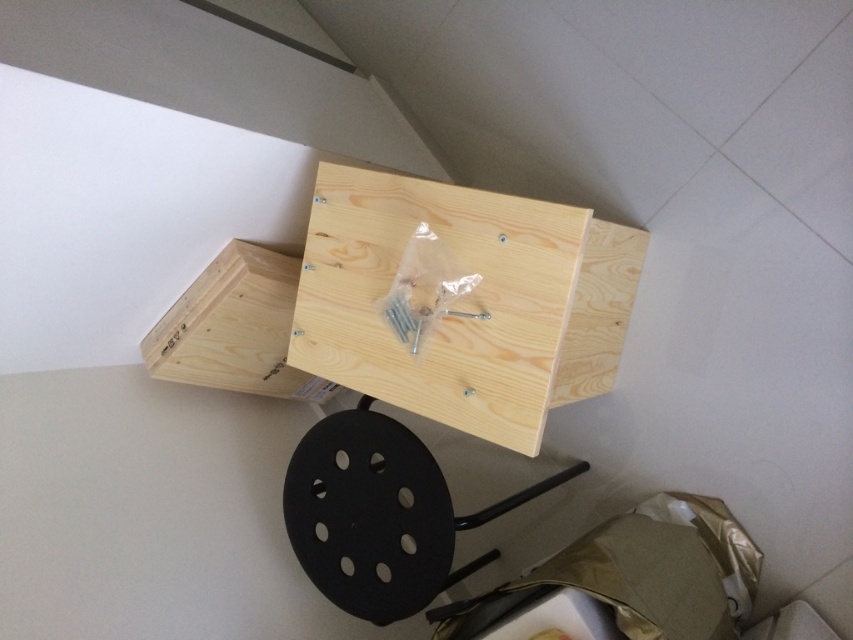
Is natural wood board at center shorter than natural wood drawer at center?

No, natural wood board at center is not shorter than natural wood drawer at center.

Can you confirm if natural wood board at center is taller than natural wood drawer at center?

Correct, natural wood board at center is much taller as natural wood drawer at center.

Measure the distance between point [360,243] and camera.

Point [360,243] and camera are 3.59 feet apart from each other.

In order to click on natural wood board at center in this screenshot , I will do `click(440, 317)`.

Can you confirm if black plastic stool at lower center is smaller than natural wood drawer at center?

Incorrect, black plastic stool at lower center is not smaller in size than natural wood drawer at center.

Locate an element on the screen. black plastic stool at lower center is located at coordinates (379, 515).

Find the location of `black plastic stool at lower center`. black plastic stool at lower center is located at coordinates (379, 515).

Can you confirm if natural wood board at center is wider than black plastic stool at lower center?

Incorrect, natural wood board at center's width does not surpass black plastic stool at lower center's.

Is point (376, 372) positioned in front of point (294, 531)?

Yes, it is.

Locate an element on the screen. The width and height of the screenshot is (853, 640). natural wood board at center is located at coordinates (440, 317).